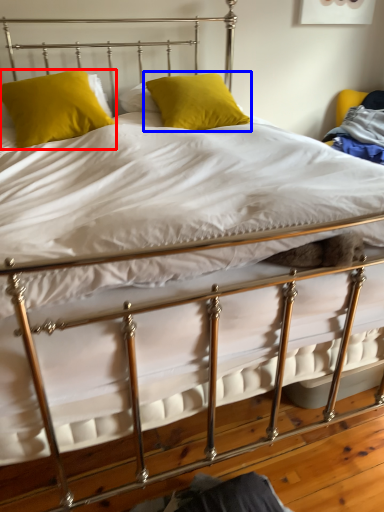
Question: Which object appears closest to the camera in this image, pillow (highlighted by a red box) or pillow (highlighted by a blue box)?

Choices:
 (A) pillow
 (B) pillow

Answer: (A)